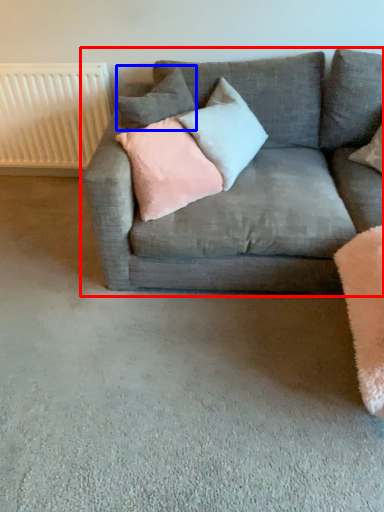
Question: Which of the following is the farthest to the observer, studio couch (highlighted by a red box) or pillow (highlighted by a blue box)?

Choices:
 (A) studio couch
 (B) pillow

Answer: (B)